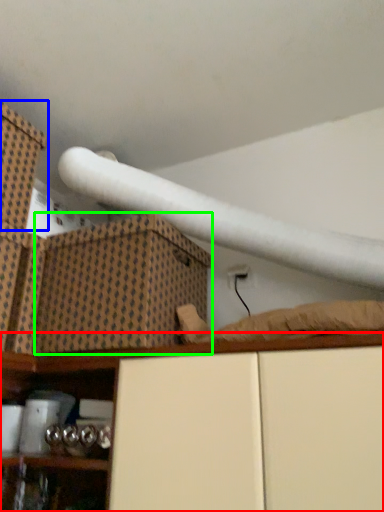
Question: Which is farther away from shelf (highlighted by a red box)? box (highlighted by a blue box) or cardboard box (highlighted by a green box)?

Choices:
 (A) box
 (B) cardboard box

Answer: (A)